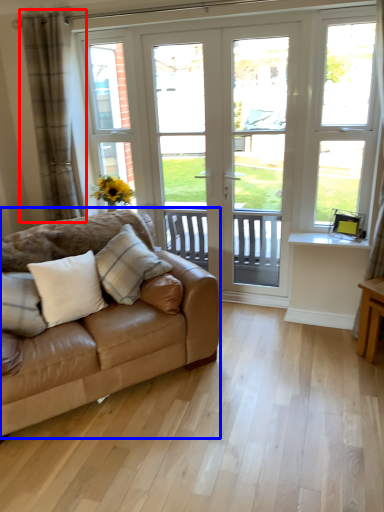
Question: Among these objects, which one is nearest to the camera, curtain (highlighted by a red box) or studio couch (highlighted by a blue box)?

Choices:
 (A) curtain
 (B) studio couch

Answer: (B)